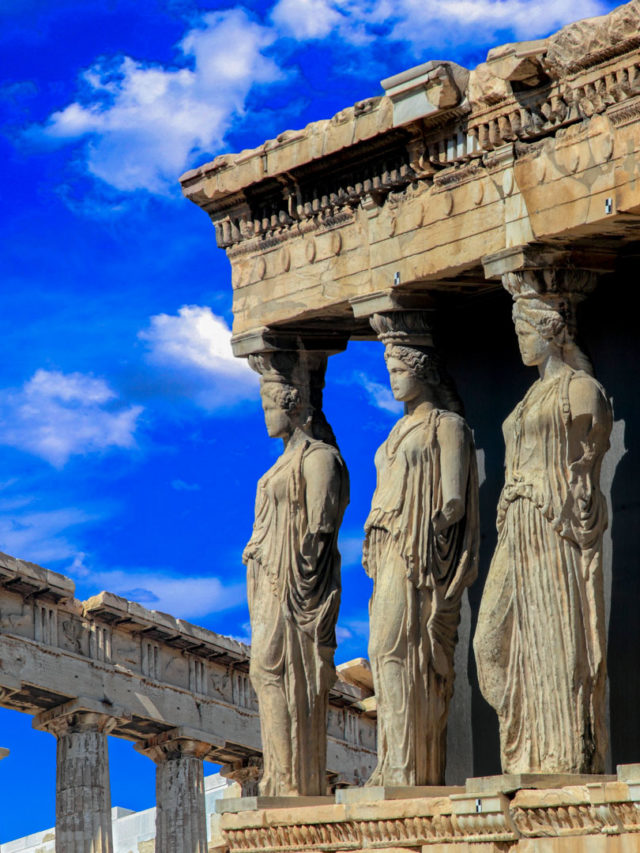
Locate an element on the screen. robe is located at coordinates (568, 711), (417, 652), (291, 688).